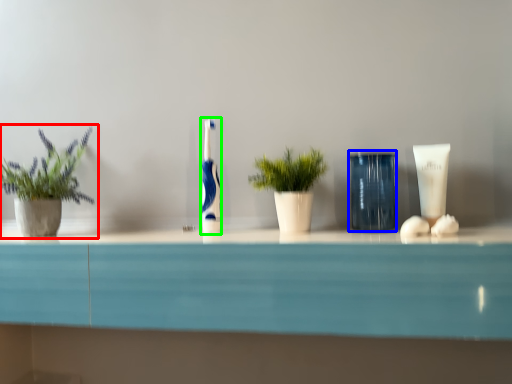
Question: Which object is the closest to the houseplant (highlighted by a red box)? Choose among these: glass vase (highlighted by a blue box) or toothbrush (highlighted by a green box).

Choices:
 (A) glass vase
 (B) toothbrush

Answer: (B)